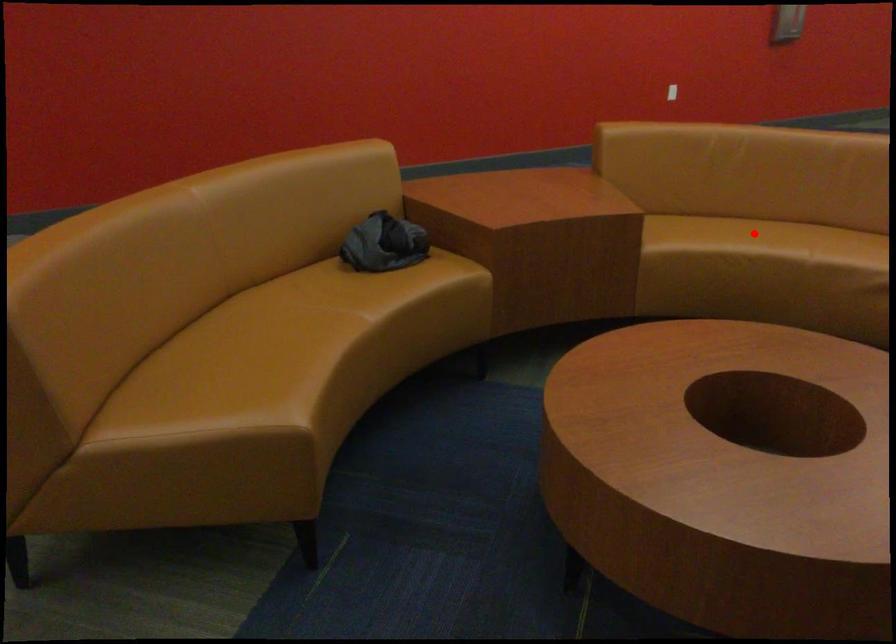
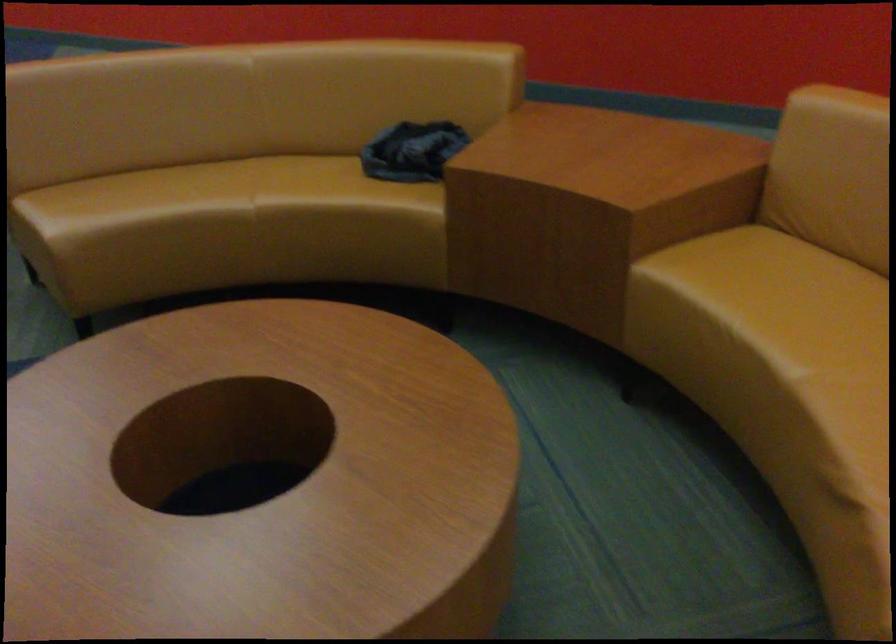
The point at the highlighted location is marked in the first image. Where is the corresponding point in the second image?

(814, 308)